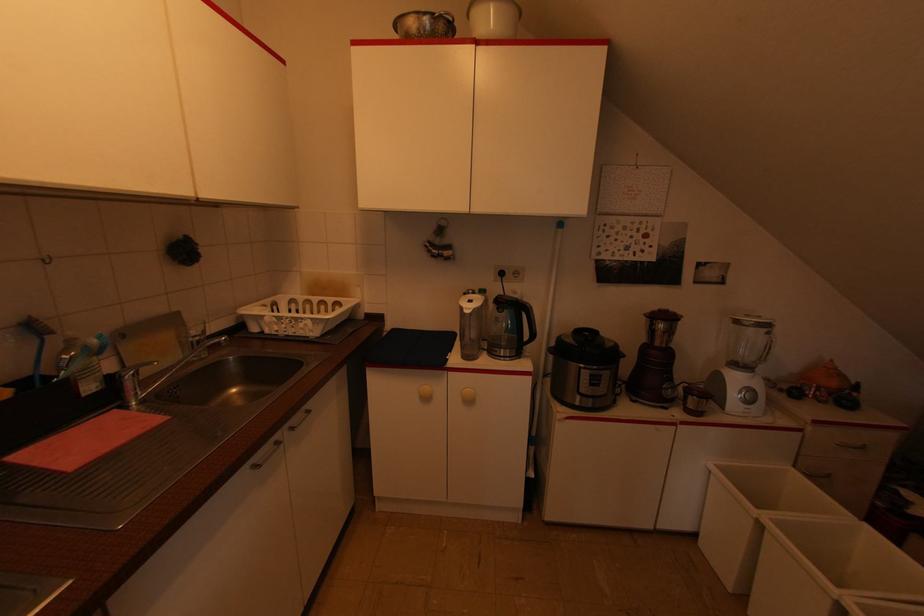
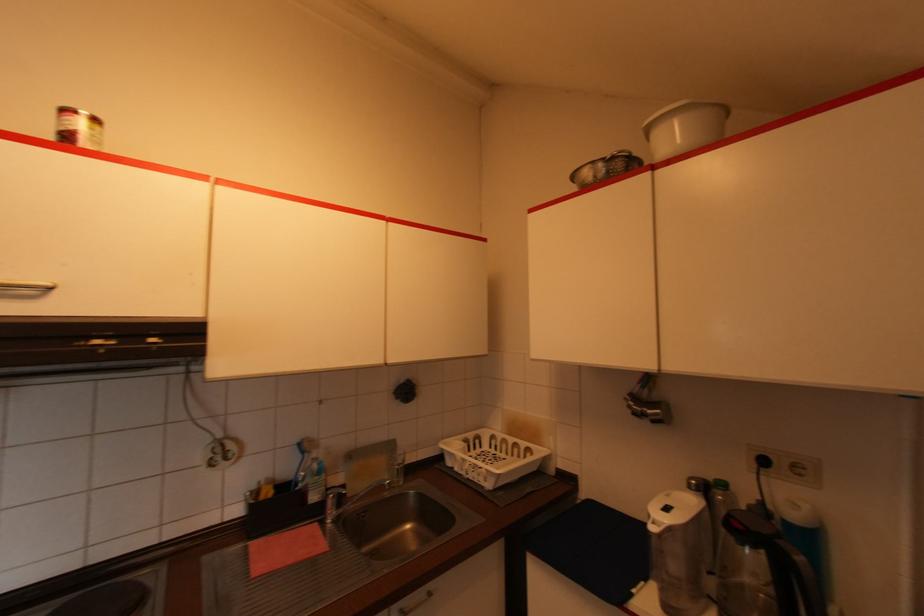
In the second image, find the point that corresponds to [315,300] in the first image.

(512, 440)